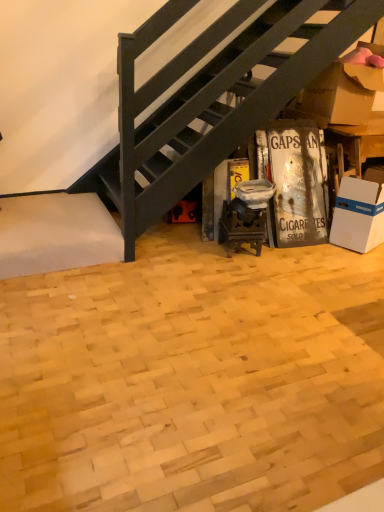
Question: Can you confirm if natural wood parquet floor at center is bigger than brown cardboard box at upper right?

Choices:
 (A) yes
 (B) no

Answer: (A)

Question: From the image's perspective, would you say natural wood parquet floor at center is positioned over brown cardboard box at upper right?

Choices:
 (A) yes
 (B) no

Answer: (B)

Question: Is natural wood parquet floor at center oriented towards brown cardboard box at upper right?

Choices:
 (A) no
 (B) yes

Answer: (A)

Question: Is natural wood parquet floor at center to the right of brown cardboard box at upper right from the viewer's perspective?

Choices:
 (A) yes
 (B) no

Answer: (B)

Question: Is natural wood parquet floor at center facing away from brown cardboard box at upper right?

Choices:
 (A) no
 (B) yes

Answer: (A)

Question: Does natural wood parquet floor at center have a lesser height compared to brown cardboard box at upper right?

Choices:
 (A) no
 (B) yes

Answer: (B)

Question: From a real-world perspective, does white cardboard box at lower right sit lower than natural wood parquet floor at center?

Choices:
 (A) yes
 (B) no

Answer: (B)

Question: Does white cardboard box at lower right lie behind natural wood parquet floor at center?

Choices:
 (A) yes
 (B) no

Answer: (A)

Question: Does white cardboard box at lower right come in front of natural wood parquet floor at center?

Choices:
 (A) no
 (B) yes

Answer: (A)

Question: From the image's perspective, would you say white cardboard box at lower right is shown under natural wood parquet floor at center?

Choices:
 (A) no
 (B) yes

Answer: (A)

Question: Are white cardboard box at lower right and natural wood parquet floor at center far apart?

Choices:
 (A) no
 (B) yes

Answer: (B)

Question: Is white cardboard box at lower right thinner than natural wood parquet floor at center?

Choices:
 (A) no
 (B) yes

Answer: (B)

Question: Is natural wood parquet floor at center closer to camera compared to white cardboard box at lower right?

Choices:
 (A) no
 (B) yes

Answer: (B)